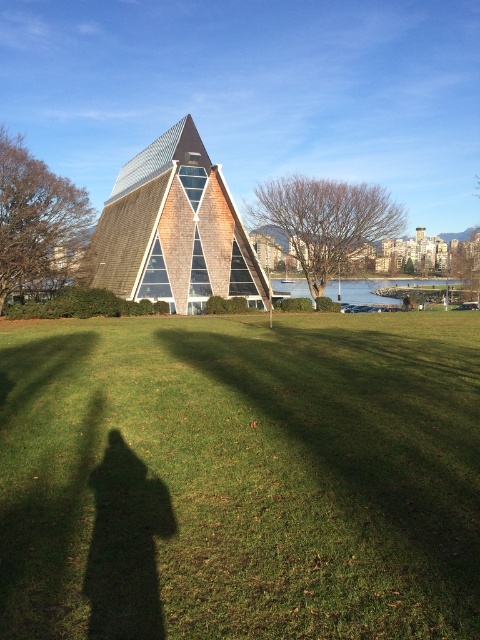
Based on the photo, can you confirm if green grass at center is shorter than wooden shingles pyramid at center?

Yes.

Who is more forward, (117, 403) or (249, 275)?

Point (117, 403) is in front.

Who is more distant from viewer, [6,570] or [214,278]?

The point [214,278] is behind.

Image resolution: width=480 pixels, height=640 pixels. In order to click on green grass at center in this screenshot , I will do `click(240, 477)`.

Can you confirm if wooden shingles pyramid at center is wider than clear blue water at lower center?

No, wooden shingles pyramid at center is not wider than clear blue water at lower center.

Is wooden shingles pyramid at center behind clear blue water at lower center?

No.

The width and height of the screenshot is (480, 640). Identify the location of wooden shingles pyramid at center. (173, 230).

Which is behind, point (275, 637) or point (358, 280)?

The point (358, 280) is behind.

Is green grass at center positioned behind clear blue water at lower center?

No, green grass at center is in front of clear blue water at lower center.

Is point (351, 560) farther from camera compared to point (453, 284)?

No, (351, 560) is in front of (453, 284).

Identify the location of green grass at center. (240, 477).